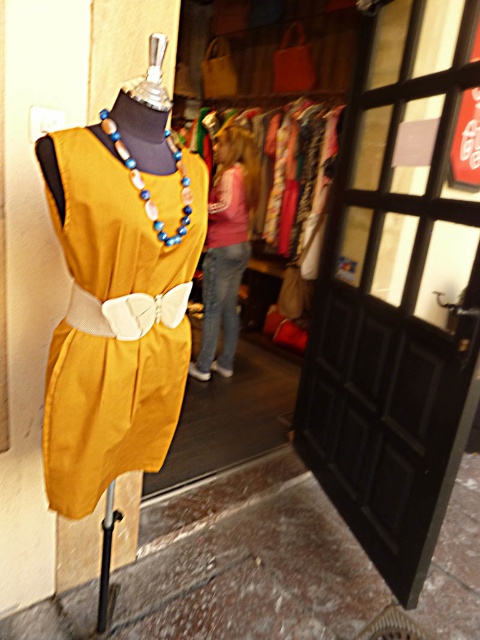
Is matte yellow fabric dress at center positioned at the back of blue and white beaded necklace at center?

No, it is in front of blue and white beaded necklace at center.

Based on the photo, can you confirm if matte yellow fabric dress at center is positioned below blue and white beaded necklace at center?

Yes, matte yellow fabric dress at center is below blue and white beaded necklace at center.

Is point (156, 316) positioned before point (117, 129)?

No, it is not.

I want to click on matte yellow fabric dress at center, so click(x=115, y=326).

Who is more distant from viewer, (244, 150) or (170, 136)?

Point (244, 150)

The height and width of the screenshot is (640, 480). I want to click on pink fabric dress at center, so click(226, 246).

Between matte yellow fabric dress at center and pink fabric dress at center, which one is positioned lower?

matte yellow fabric dress at center

Is point (123, 275) positioned behind point (257, 170)?

No, (123, 275) is closer to viewer.

Image resolution: width=480 pixels, height=640 pixels. I want to click on matte yellow fabric dress at center, so click(x=115, y=326).